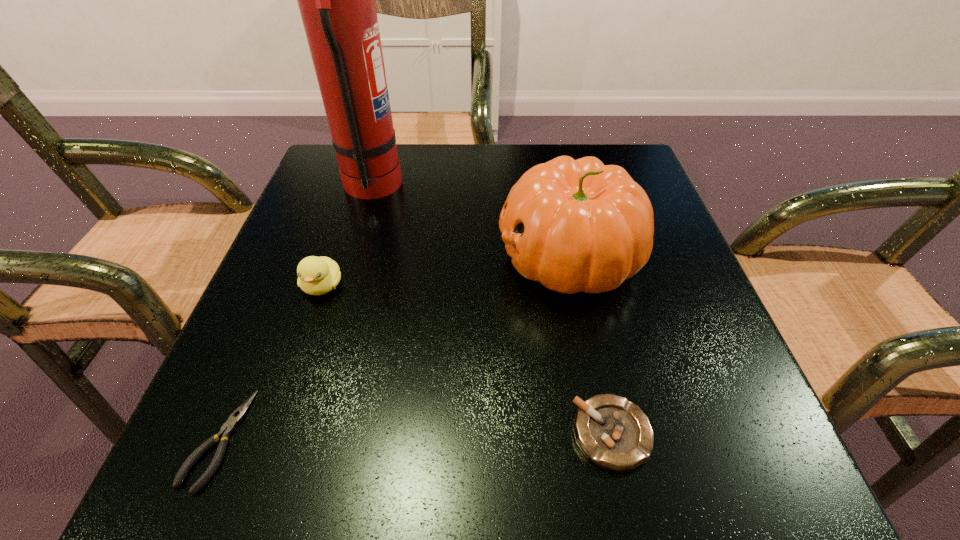
The width and height of the screenshot is (960, 540). Find the location of `fire extinguisher`. fire extinguisher is located at coordinates (336, 0).

Locate an element on the screen. The width and height of the screenshot is (960, 540). the tallest object is located at coordinates [x=336, y=0].

Find the location of a particular element. Image resolution: width=960 pixels, height=540 pixels. pumpkin is located at coordinates (578, 225).

Locate an element on the screen. This screenshot has width=960, height=540. the third shortest object is located at coordinates (316, 275).

Locate an element on the screen. This screenshot has height=540, width=960. ashtray is located at coordinates (612, 432).

Where is `pliers`? The width and height of the screenshot is (960, 540). pliers is located at coordinates (228, 428).

Locate an element on the screen. the shortest object is located at coordinates (228, 428).

You are a GUI agent. You are given a task and a screenshot of the screen. Output one action in this format:
    pyautogui.click(x=<x>, y=<y>)
    Task: Click on the vacant space located on the label side of the farthest object
    
    Given the screenshot: What is the action you would take?
    pyautogui.click(x=465, y=187)

Identify the location of vacant space situated 0.270m on the carved face of the second tallest object. The height and width of the screenshot is (540, 960). (351, 256).

I want to click on vacant space situated 0.120m on the carved face of the second tallest object, so click(433, 256).